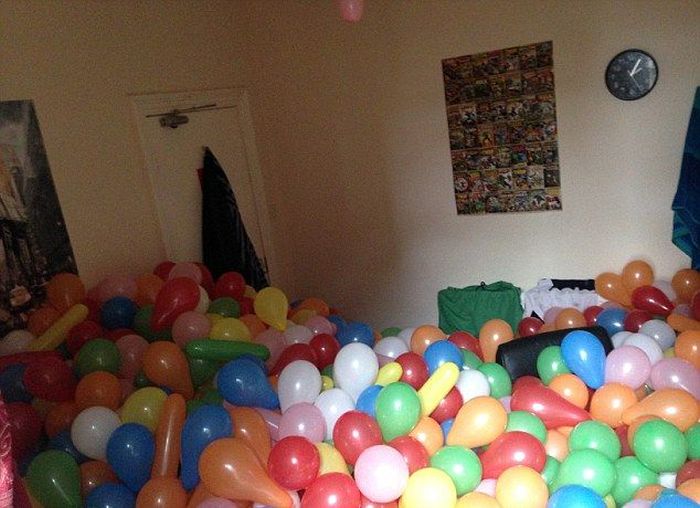
Locate an element on the screen. door is located at coordinates click(x=169, y=145).